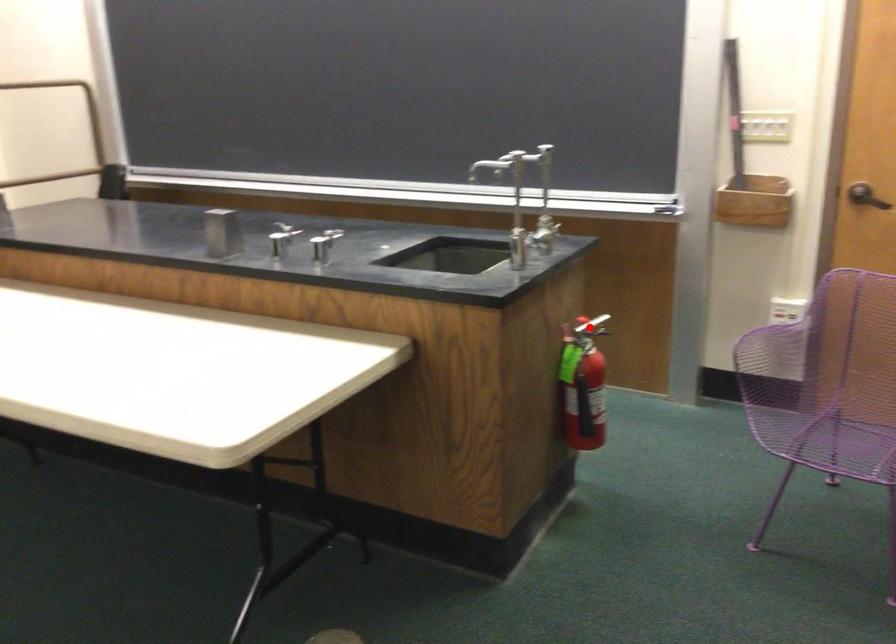
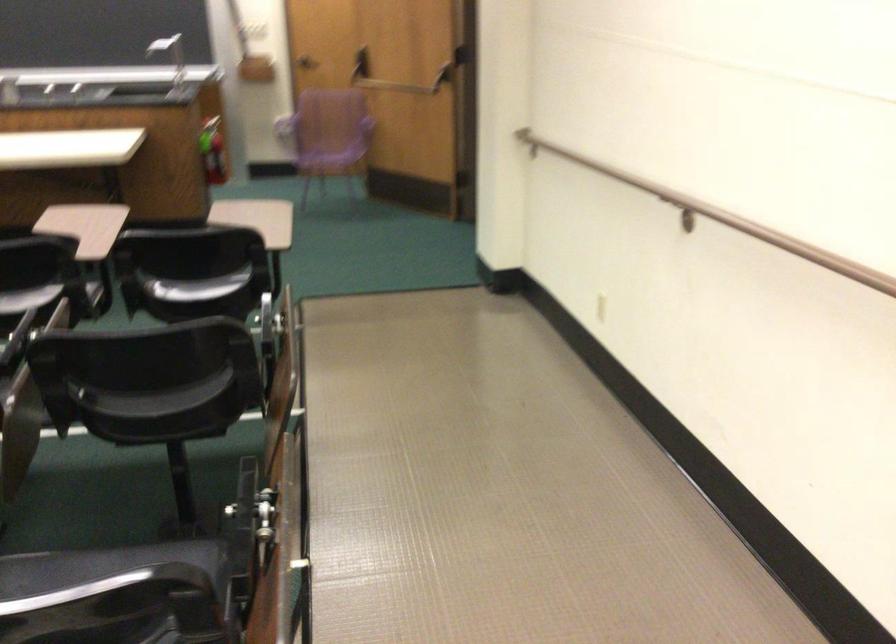
Question: I am providing you with two images of the same scene from different viewpoints. In image1, a red point is highlighted. Considering the same 3D point in image2, which of the following is correct?

Choices:
 (A) It is closer
 (B) It is farther

Answer: (B)